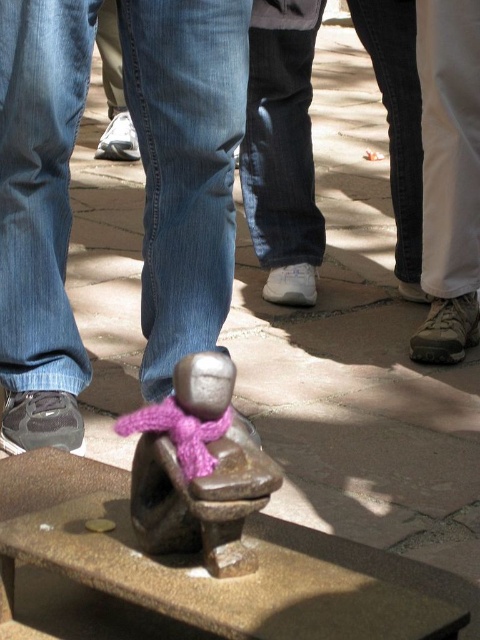
Question: Does denim jeans at center have a greater width compared to purple knitted scarf at center?

Choices:
 (A) no
 (B) yes

Answer: (B)

Question: Which of these objects is positioned farthest from the matte black shoe at lower left?

Choices:
 (A) purple knitted scarf at center
 (B) matte white shoe at lower right
 (C) white fabric pants at right
 (D) bronze statue at center

Answer: (B)

Question: Is leather shoe at lower right below matte white shoe at lower right?

Choices:
 (A) no
 (B) yes

Answer: (B)

Question: Can you confirm if bronze stone bench at center is bigger than white matte shoe at center?

Choices:
 (A) no
 (B) yes

Answer: (B)

Question: Which of the following is the farthest from the observer?

Choices:
 (A) (24, 362)
 (B) (128, 132)

Answer: (B)

Question: Which object is positioned farthest from the matte white shoe at lower right?

Choices:
 (A) denim jeans at center
 (B) white fabric pants at right
 (C) matte black shoe at lower left
 (D) leather shoe at lower right

Answer: (C)